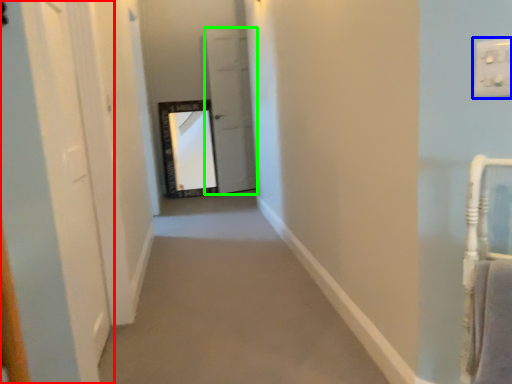
Question: Considering the real-world distances, which object is farthest from door (highlighted by a red box)? electric outlet (highlighted by a blue box) or door (highlighted by a green box)?

Choices:
 (A) electric outlet
 (B) door

Answer: (B)